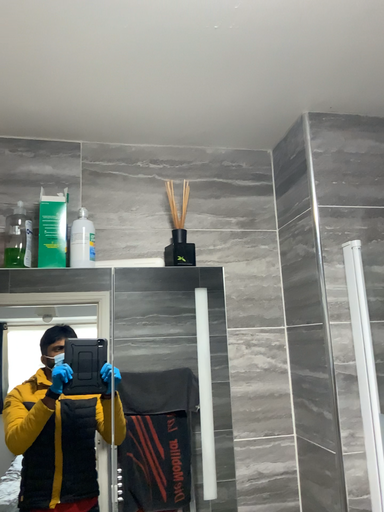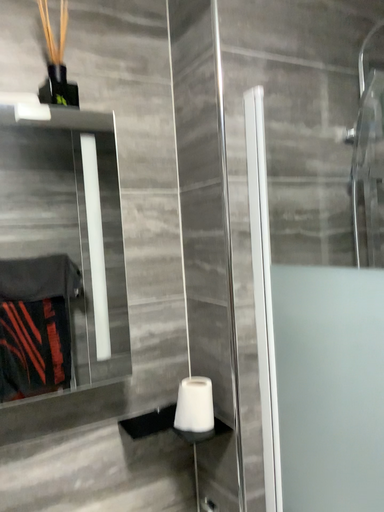
Question: Which way did the camera rotate in the video?

Choices:
 (A) rotated right
 (B) rotated left

Answer: (A)